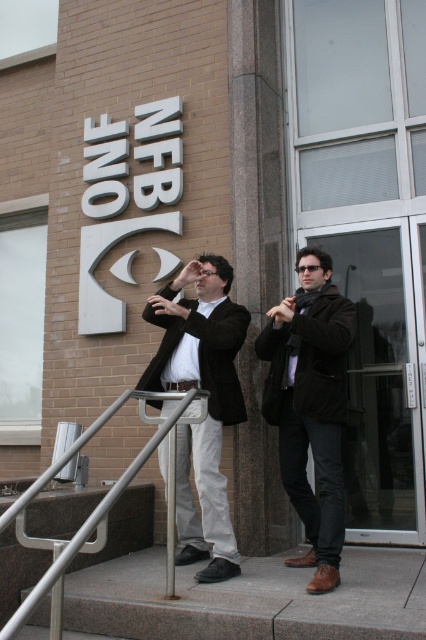
Is velvet brown coat at center taller than silver metallic handrail at lower center?

Yes, velvet brown coat at center is taller than silver metallic handrail at lower center.

Does velvet brown coat at center appear on the left side of silver metallic handrail at lower center?

In fact, velvet brown coat at center is to the right of silver metallic handrail at lower center.

Which is behind, point (317, 404) or point (170, 454)?

The point (317, 404) is behind.

I want to click on velvet brown coat at center, so click(310, 404).

Does matte black jacket at center have a lesser width compared to silver metallic handrail at lower center?

Yes, matte black jacket at center is thinner than silver metallic handrail at lower center.

Who is more distant from viewer, (216, 321) or (51, 625)?

Point (216, 321)

Does point (201, 448) come closer to viewer compared to point (40, 481)?

No.

Where is `matte black jacket at center`? This screenshot has height=640, width=426. matte black jacket at center is located at coordinates (207, 403).

What do you see at coordinates (310, 404) in the screenshot? I see `velvet brown coat at center` at bounding box center [310, 404].

Does velvet brown coat at center have a larger size compared to matte black jacket at center?

No.

Who is more forward, (287, 458) or (222, 285)?

Point (287, 458)

The width and height of the screenshot is (426, 640). What are the coordinates of `velvet brown coat at center` in the screenshot? It's located at pyautogui.click(x=310, y=404).